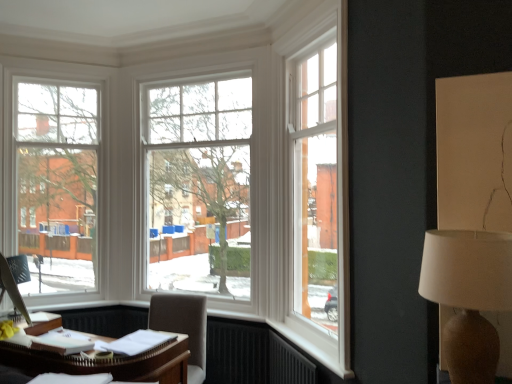
Question: Is point (182, 321) closer or farther from the camera than point (210, 175)?

Choices:
 (A) closer
 (B) farther

Answer: (A)

Question: Is light brown fabric chair at lower center inside the boundaries of white wooden window at center, the first window from the right, or outside?

Choices:
 (A) outside
 (B) inside

Answer: (A)

Question: Which of these objects is positioned closest to the white wooden window at center, the first window from the right?

Choices:
 (A) clear glass window at left, which is the 2th window from right to left
 (B) white fabric lampshade at right
 (C) light brown fabric chair at lower center

Answer: (A)

Question: Which is nearer to the white fabric lampshade at right?

Choices:
 (A) clear glass window at left, which appears as the 1th window when viewed from the left
 (B) white wooden window at center, the first window from the right
 (C) light brown fabric chair at lower center

Answer: (C)